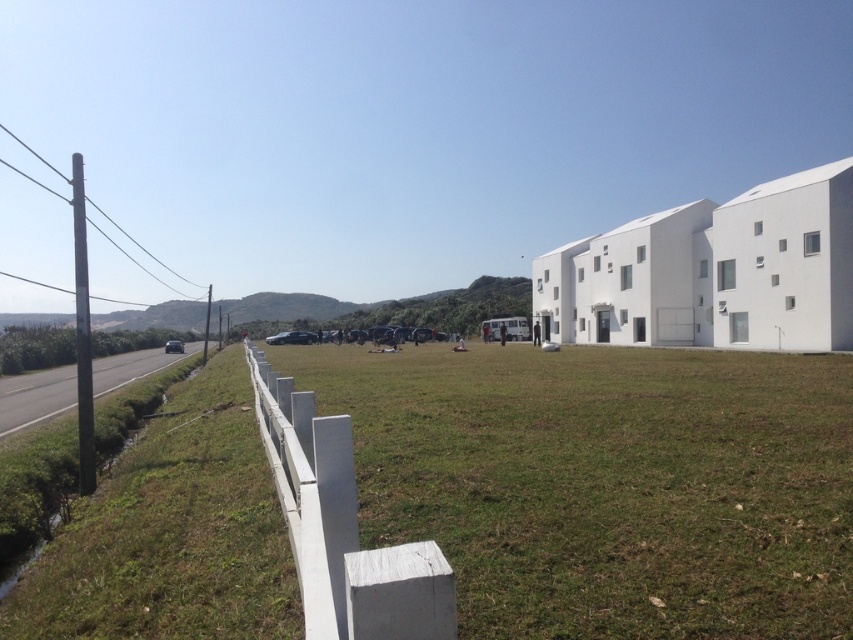
Between point (668, 582) and point (355, 524), which one is positioned behind?

Point (668, 582)

Based on the photo, can you confirm if green grass at center is taller than white painted wood fence at center?

No, green grass at center is not taller than white painted wood fence at center.

At what (x,y) coordinates should I click in order to perform the action: click on green grass at center. Please return your answer as a coordinate pair (x, y). The width and height of the screenshot is (853, 640). Looking at the image, I should click on (607, 483).

Locate an element on the screen. green grass at center is located at coordinates (607, 483).